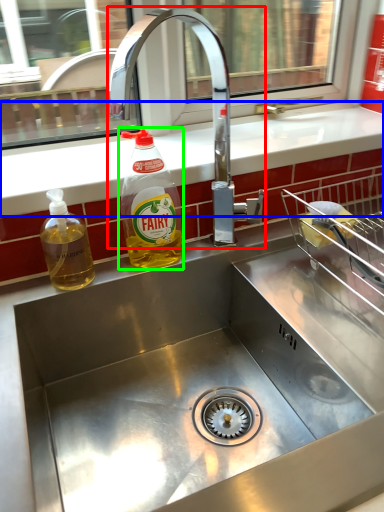
Question: Which object is positioned farthest from tap (highlighted by a red box)? Select from counter top (highlighted by a blue box) and bottle (highlighted by a green box).

Choices:
 (A) counter top
 (B) bottle

Answer: (B)